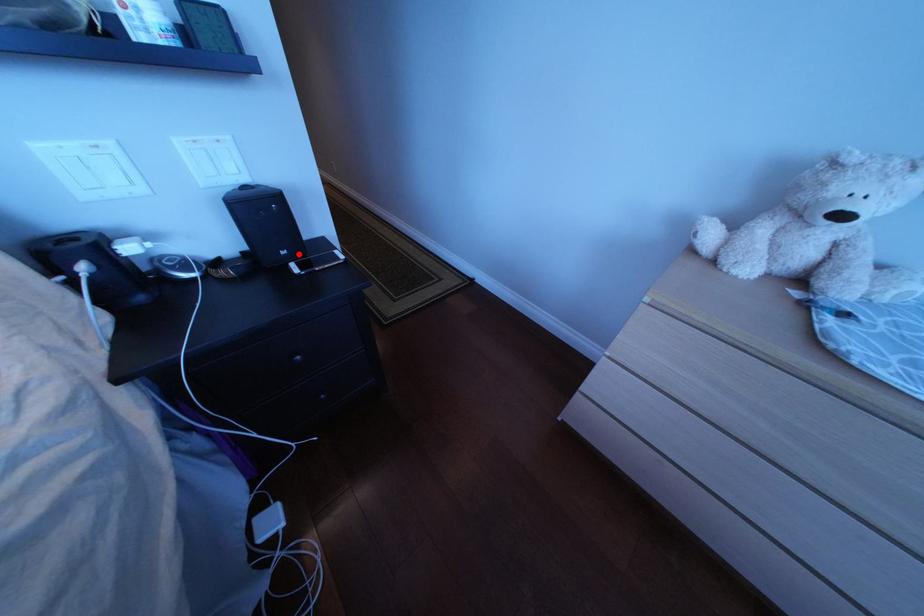
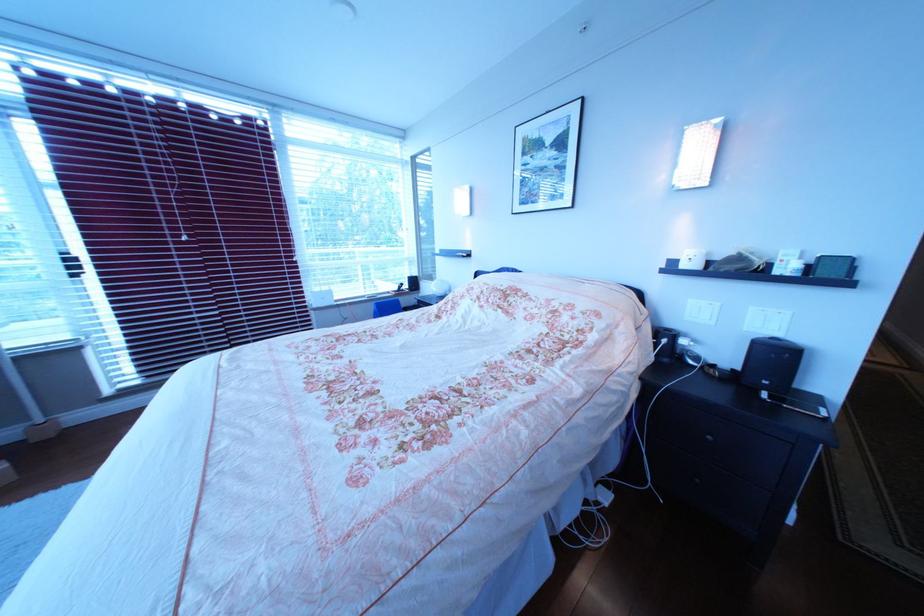
In the second image, find the point that corresponds to the highlighted location in the first image.

(782, 384)